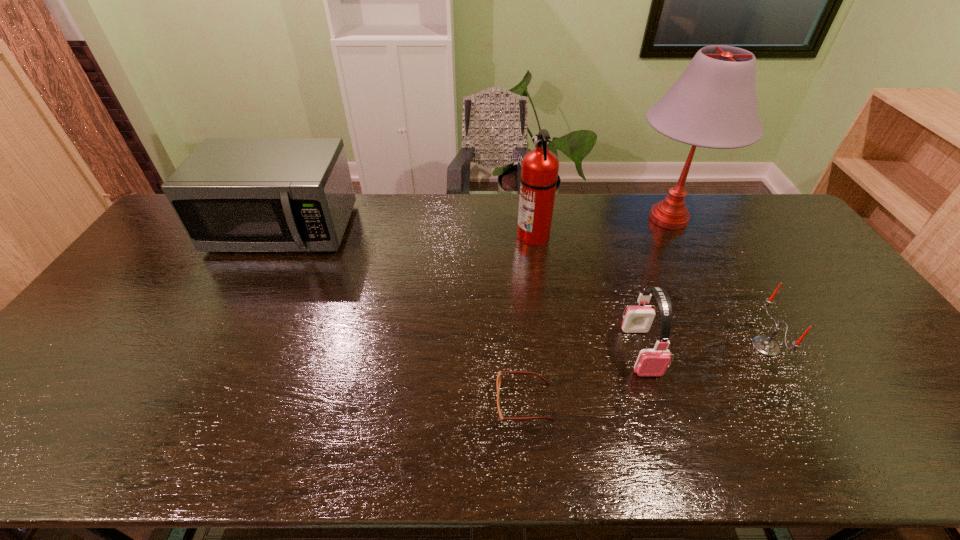
The width and height of the screenshot is (960, 540). What are the coordinates of `vacant point located on the front-facing side of the tallest object` in the screenshot? It's located at (583, 219).

The image size is (960, 540). Find the location of `vacant region located 0.070m on the front-facing side of the tallest object`. vacant region located 0.070m on the front-facing side of the tallest object is located at coordinates (603, 219).

What are the coordinates of `vacant region located at the nozzle of the second tallest object` in the screenshot? It's located at (495, 235).

Locate an element on the screen. This screenshot has height=540, width=960. free space located at the nozzle of the second tallest object is located at coordinates (416, 235).

Where is `vacant space located 0.180m at the nozzle of the second tallest object`? vacant space located 0.180m at the nozzle of the second tallest object is located at coordinates (463, 235).

You are a GUI agent. You are given a task and a screenshot of the screen. Output one action in this format:
    pyautogui.click(x=<x>, y=<y>)
    Task: Click on the free space located on the front-facing side of the leftmost object
    Image resolution: width=960 pixels, height=540 pixels.
    Given the screenshot: What is the action you would take?
    pyautogui.click(x=245, y=302)

This screenshot has width=960, height=540. Identify the location of vacant space located 0.060m on the outer surface of the earphone. tap(657, 400).

You are a GUI agent. You are given a task and a screenshot of the screen. Output one action in this format:
    pyautogui.click(x=<x>, y=<y>)
    Task: Click on the vacant region located on the front-facing side of the second shortest object
    
    Given the screenshot: What is the action you would take?
    pyautogui.click(x=661, y=346)

At what (x,y) coordinates should I click in order to perform the action: click on vacant space located on the front-facing side of the second shortest object. Please return your answer as a coordinate pair (x, y). This screenshot has width=960, height=540. Looking at the image, I should click on (627, 346).

You are a GUI agent. You are given a task and a screenshot of the screen. Output one action in this format:
    pyautogui.click(x=<x>, y=<y>)
    Task: Click on the vacant region located on the front-facing side of the second shortest object
    The height and width of the screenshot is (540, 960).
    Given the screenshot: What is the action you would take?
    pyautogui.click(x=619, y=346)